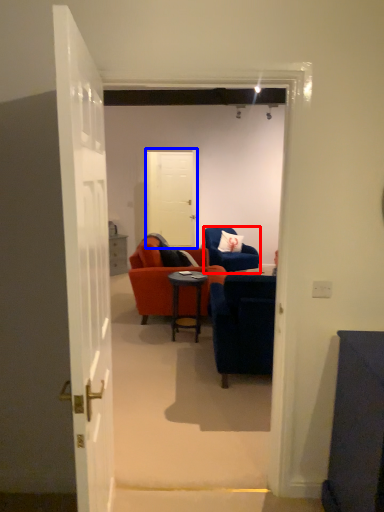
Question: Which point is closer to the camera, chair (highlighted by a red box) or door (highlighted by a blue box)?

Choices:
 (A) chair
 (B) door

Answer: (A)